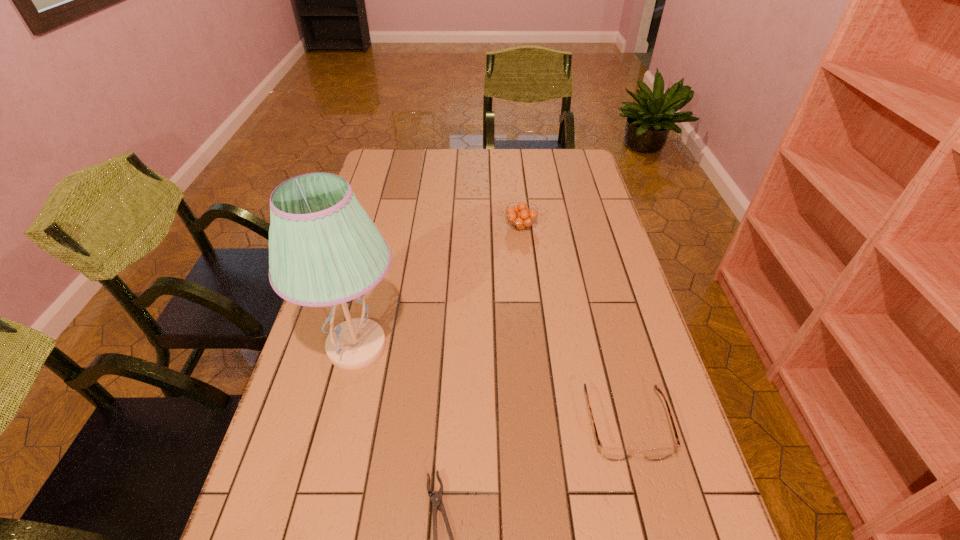
The height and width of the screenshot is (540, 960). Find the location of `the leftmost object`. the leftmost object is located at coordinates (317, 258).

What are the coordinates of `lamp` in the screenshot? It's located at (317, 258).

The height and width of the screenshot is (540, 960). I want to click on the third object from left to right, so click(520, 216).

Where is `orange fruit`? orange fruit is located at coordinates (520, 216).

At what (x,y) coordinates should I click in order to perform the action: click on the second nearest object. Please return your answer as a coordinate pair (x, y). Image resolution: width=960 pixels, height=540 pixels. Looking at the image, I should click on pos(612,454).

Identify the location of spectacles. (612, 454).

What are the coordinates of `vacant space situated 0.210m on the front of the tallest object` in the screenshot? It's located at (324, 477).

Where is `vacant space located on the left of the orange fruit`? This screenshot has height=540, width=960. vacant space located on the left of the orange fruit is located at coordinates (x=478, y=226).

Find the location of `vacant space located 0.080m on the front-facing side of the rightmost object`. vacant space located 0.080m on the front-facing side of the rightmost object is located at coordinates (646, 504).

The width and height of the screenshot is (960, 540). What are the coordinates of `object that is at the left edge` in the screenshot? It's located at (317, 258).